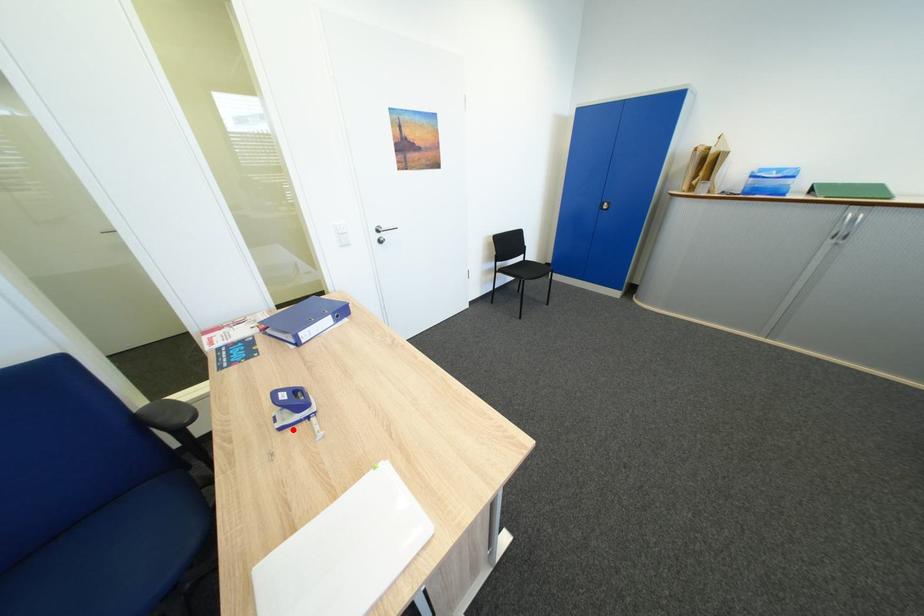
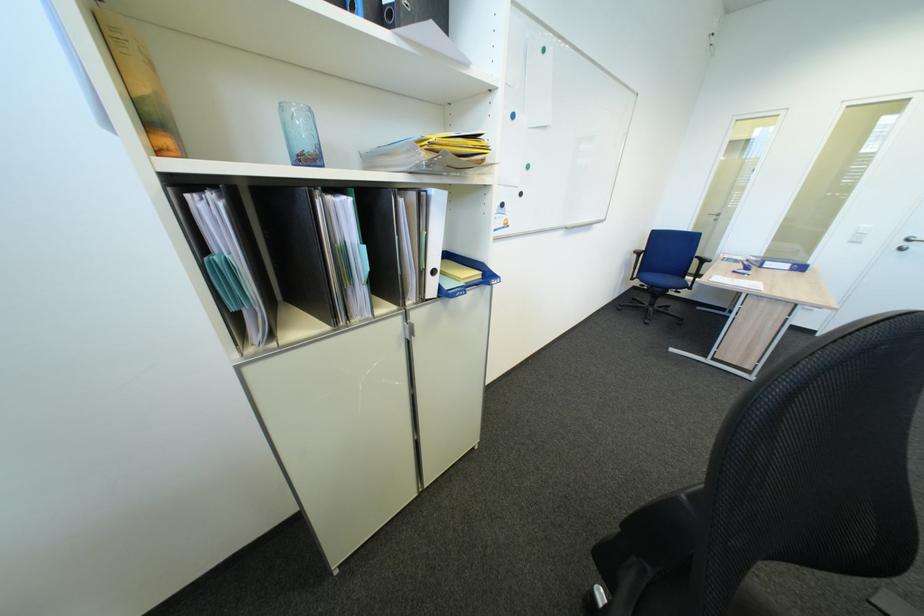
Locate, in the second image, the point that corresponds to the highlighted location in the first image.

(745, 274)